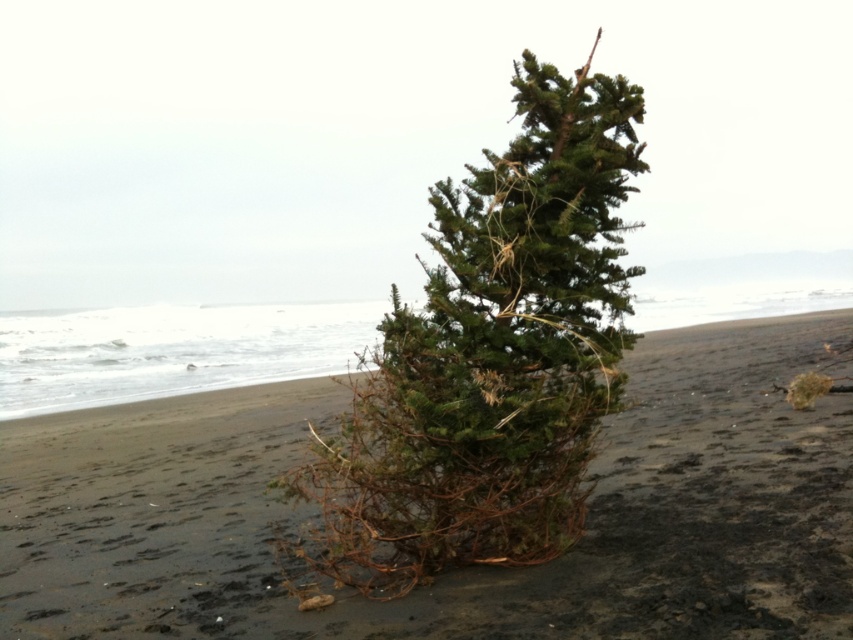
Is dark brown sand at center closer to camera compared to green needle-like at center?

Yes, it is.

Is point (654, 356) in front of point (573, 516)?

No, (654, 356) is behind (573, 516).

Is point (805, 348) farther from viewer compared to point (486, 324)?

Yes, it is.

At what (x,y) coordinates should I click in order to perform the action: click on dark brown sand at center. Please return your answer as a coordinate pair (x, y). Image resolution: width=853 pixels, height=640 pixels. Looking at the image, I should click on (465, 566).